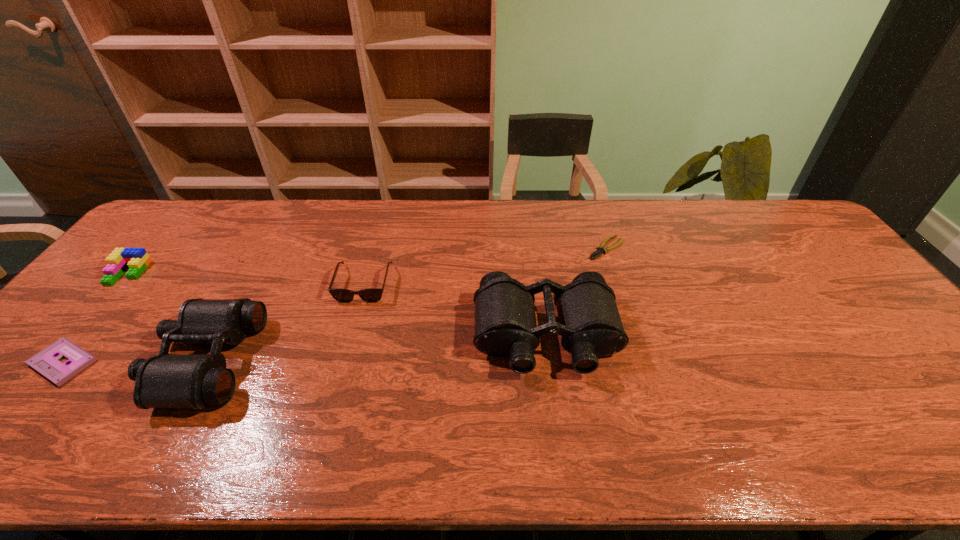
Where is `the left binoculars`? This screenshot has width=960, height=540. the left binoculars is located at coordinates (197, 381).

Where is `the fifth shortest object`? the fifth shortest object is located at coordinates (x=197, y=381).

Locate an element on the screen. The width and height of the screenshot is (960, 540). the tallest object is located at coordinates (590, 324).

In order to click on the right binoculars in this screenshot , I will do `click(590, 324)`.

In order to click on the shortest object in this screenshot , I will do `click(601, 249)`.

Locate an element on the screen. The width and height of the screenshot is (960, 540). sunglasses is located at coordinates (372, 295).

The height and width of the screenshot is (540, 960). Find the location of `Lego`. Lego is located at coordinates (137, 259).

Where is `the second shortest object`? the second shortest object is located at coordinates coord(46,362).

Locate an element on the screen. This screenshot has width=960, height=540. free space located 0.300m through the eyepieces of the second tallest object is located at coordinates (37, 360).

Identify the location of free region located through the eyepieces of the second tallest object. Image resolution: width=960 pixels, height=540 pixels. (131, 360).